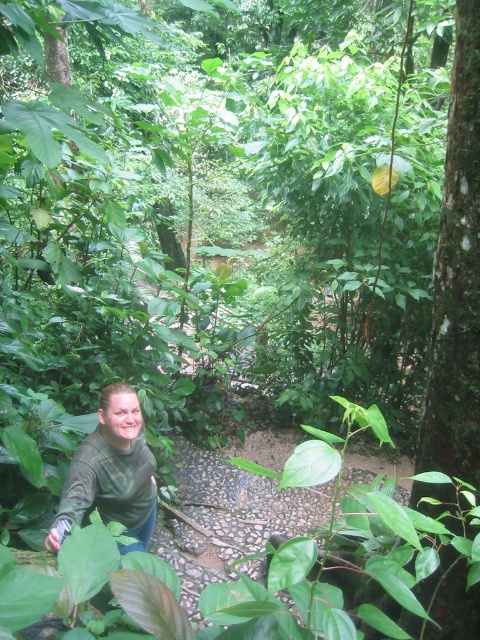
Consider the image. Can you confirm if green rough bark tree at right is positioned to the right of green matte shirt at lower left?

Indeed, green rough bark tree at right is positioned on the right side of green matte shirt at lower left.

Who is more distant from viewer, (462,396) or (122,486)?

Point (122,486)

This screenshot has height=640, width=480. In order to click on green rough bark tree at right in this screenshot , I will do `click(456, 275)`.